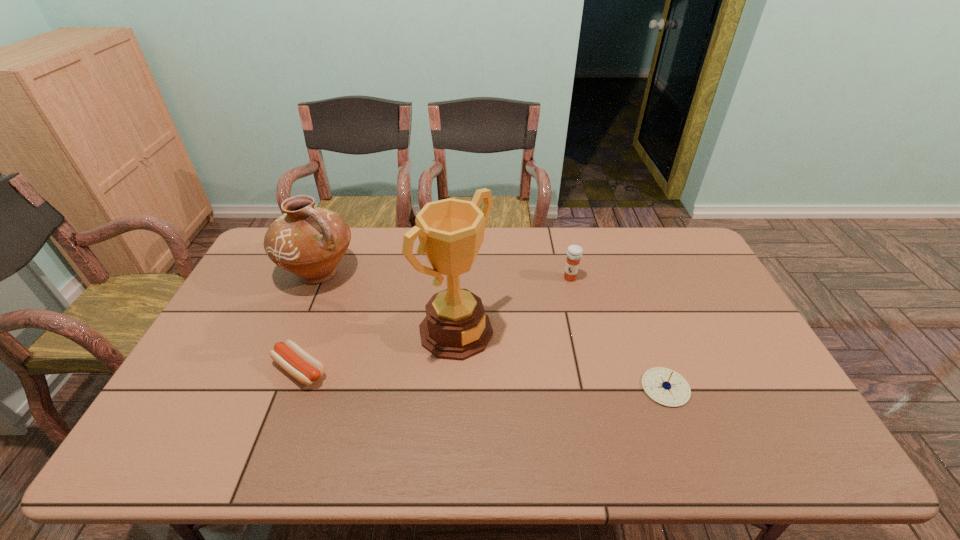
Identify the location of object that is positioned at the near edge. (665, 386).

Find the location of a particular element. The image size is (960, 540). object that is at the left edge is located at coordinates (308, 241).

You are a GUI agent. You are given a task and a screenshot of the screen. Output one action in this format:
    pyautogui.click(x=<x>, y=<y>)
    Task: Click on the object that is positioned at the far left corner
    
    Given the screenshot: What is the action you would take?
    pyautogui.click(x=308, y=241)

This screenshot has height=540, width=960. What are the coordinates of `free space at the far edge of the desktop` in the screenshot? It's located at (543, 253).

This screenshot has height=540, width=960. What are the coordinates of `vacant space at the near edge of the desktop` in the screenshot? It's located at (459, 407).

I want to click on free space at the left edge of the desktop, so click(279, 286).

At what (x,y) coordinates should I click in order to perform the action: click on vacant space at the right edge of the desktop. Please return your answer as a coordinate pair (x, y). The width and height of the screenshot is (960, 540). Looking at the image, I should click on (698, 290).

This screenshot has height=540, width=960. In order to click on free spot between the pottery and the sausage in this screenshot , I will do `click(309, 321)`.

Where is `vacant region between the third object from left to right and the third tallest object`? vacant region between the third object from left to right and the third tallest object is located at coordinates (513, 305).

Locate an element on the screen. This screenshot has height=540, width=960. blank region between the award and the shortest object is located at coordinates (378, 350).